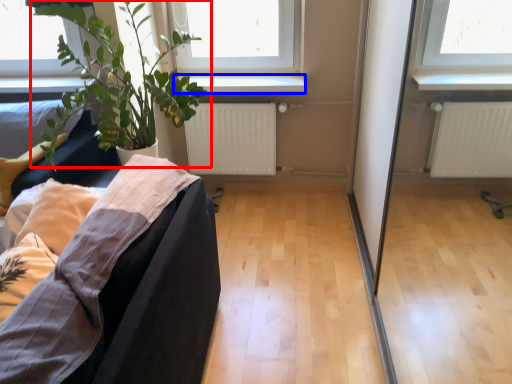
Question: Which object is closer to the camera taking this photo, houseplant (highlighted by a red box) or window sill (highlighted by a blue box)?

Choices:
 (A) houseplant
 (B) window sill

Answer: (A)